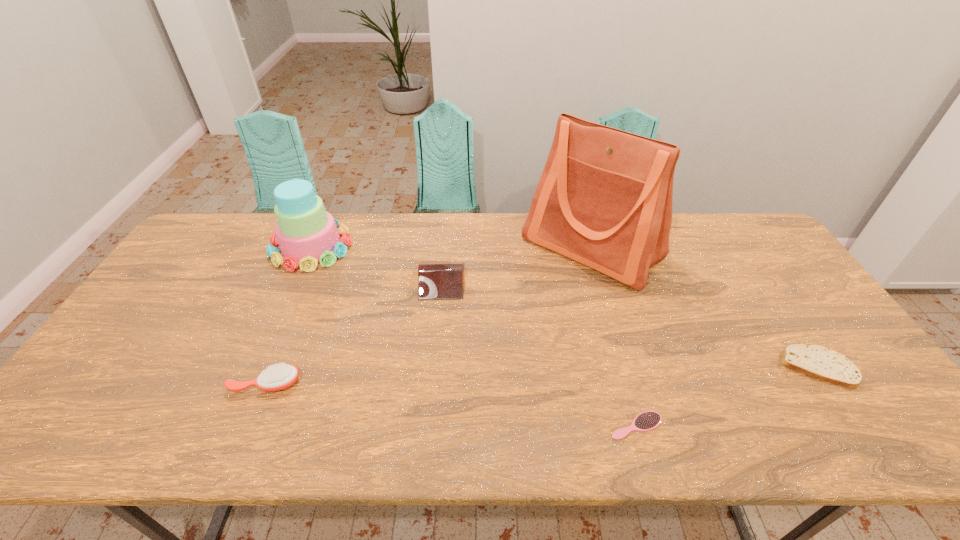
This screenshot has height=540, width=960. I want to click on free space between the fifth shortest object and the rightmost object, so click(564, 307).

At what (x,y) coordinates should I click in order to perform the action: click on vacant space that is in between the fifth tallest object and the nearer hairbrush. Please return your answer as a coordinate pair (x, y). Looking at the image, I should click on (726, 396).

I want to click on free space between the tallest object and the nearer hairbrush, so click(613, 337).

You are a GUI agent. You are given a task and a screenshot of the screen. Output one action in this format:
    pyautogui.click(x=<x>, y=<y>)
    Task: Click on the object that is the fifth nearest to the nearer hairbrush
    This screenshot has width=960, height=540.
    Given the screenshot: What is the action you would take?
    pyautogui.click(x=307, y=234)

Where is `the third closest object to the cake`? the third closest object to the cake is located at coordinates coord(604,199).

Identify the location of vacant space that satisfies the following two spatial constraints: 1. on the front side of the second tallest object; 2. on the left side of the tallest object. (310, 248).